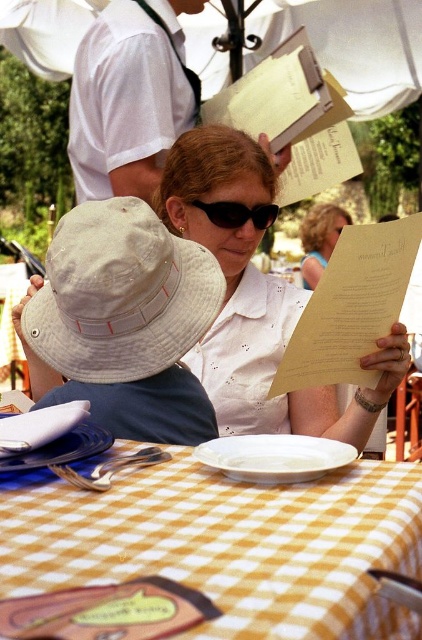
Question: Among these points, which one is nearest to the camera?

Choices:
 (A) (241, 268)
 (B) (253, 488)
 (C) (115, 276)
 (D) (208, 205)

Answer: (B)

Question: Which object is the farthest from the white paper menu at center?

Choices:
 (A) beige fabric hat at upper left
 (B) white shirt at upper left

Answer: (B)

Question: From the image, what is the correct spatial relationship of yellow checkered tablecloth at center in relation to white shirt at upper left?

Choices:
 (A) right
 (B) left

Answer: (A)

Question: Is white paper menu at center bigger than sunglasses at center?

Choices:
 (A) yes
 (B) no

Answer: (A)

Question: Based on their relative distances, which object is farther from the yellow checkered tablecloth at center?

Choices:
 (A) white paper menu at center
 (B) white shirt at upper left
 (C) sunglasses at center
 (D) beige fabric hat at upper left

Answer: (B)

Question: In this image, where is white shirt at upper left located relative to sunglasses at center?

Choices:
 (A) left
 (B) right

Answer: (A)